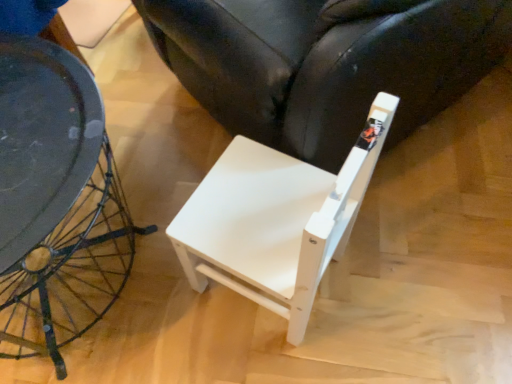
Find the location of `free location in front of white matte chair at center, the 1th chair from the bottom`. free location in front of white matte chair at center, the 1th chair from the bottom is located at coordinates (280, 354).